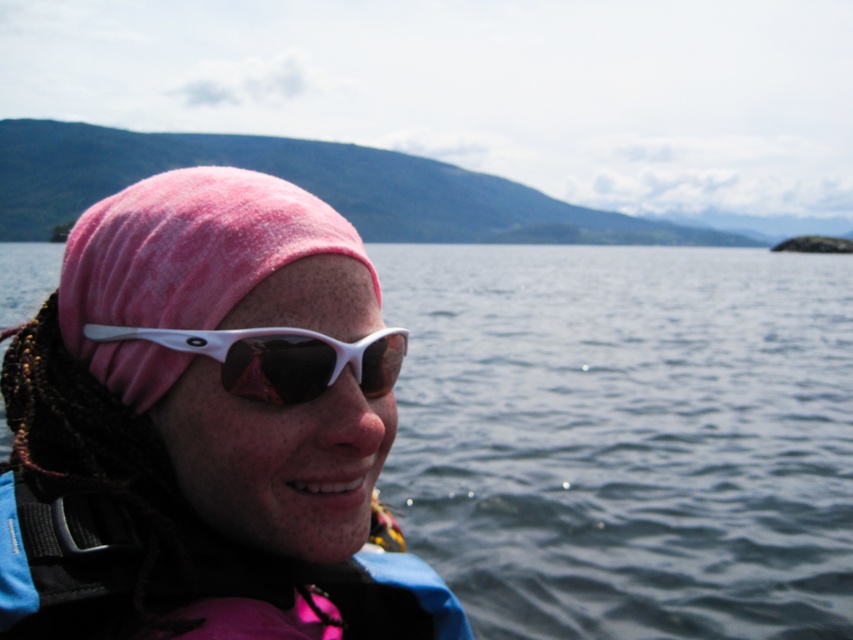
You are a photographer trying to capture the pink fleece beanie at upper left and the white matte sunglasses at center in a single frame. Given their sizes, which object will appear bigger in the photo?

The pink fleece beanie at upper left will appear bigger in the photo because it has a larger size compared to the white matte sunglasses at center.

You are a photographer trying to capture a close shot of the pink fleece beanie at upper left and the blue fabric life jacket at lower left. Given that your camera has a maximum focus range of 3.8 inches, will you be able to focus on both objects simultaneously?

The distance between the pink fleece beanie at upper left and the blue fabric life jacket at lower left is 3.88 inches. Since your camera can only focus within 3.8 inches, the objects are slightly beyond the focus range, so you won